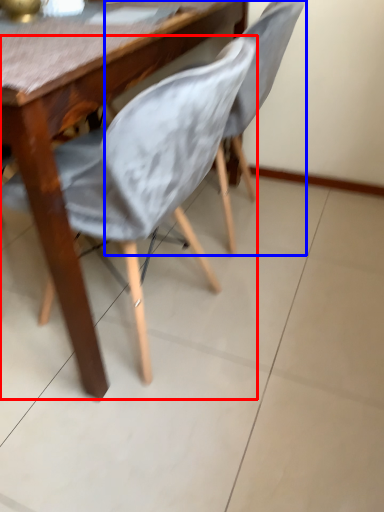
Question: Which point is closer to the camera, chair (highlighted by a red box) or chair (highlighted by a blue box)?

Choices:
 (A) chair
 (B) chair

Answer: (A)